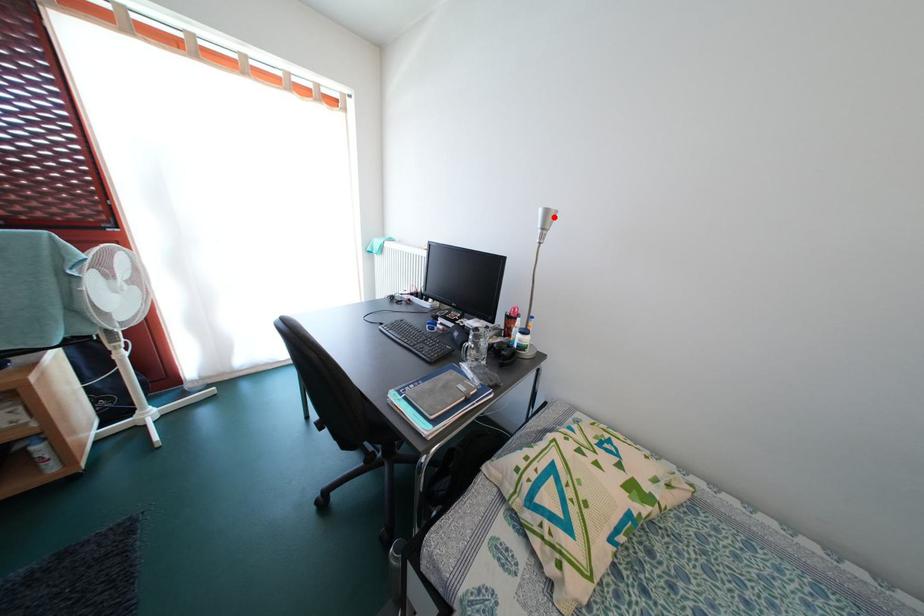
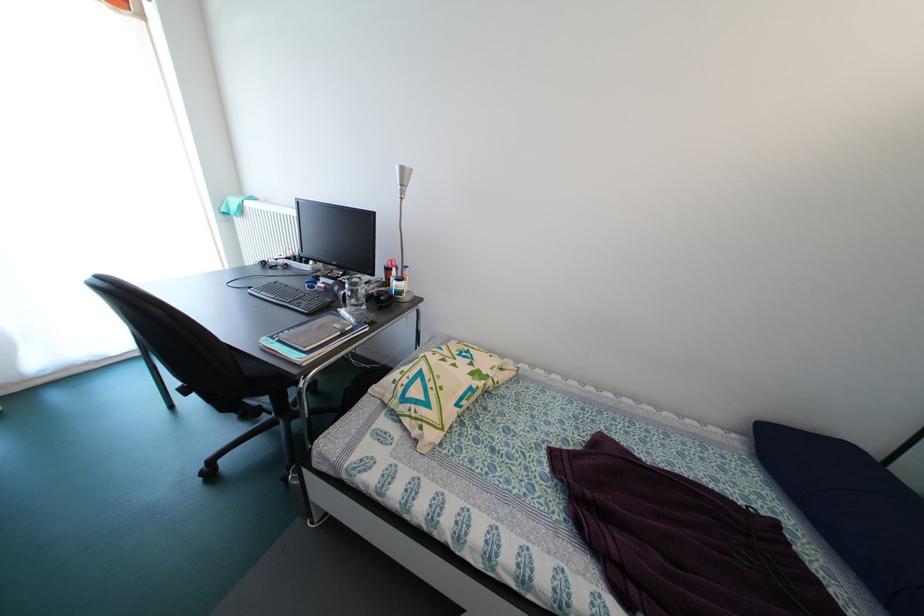
Locate, in the second image, the point that corresponds to the highlighted location in the first image.

(409, 175)